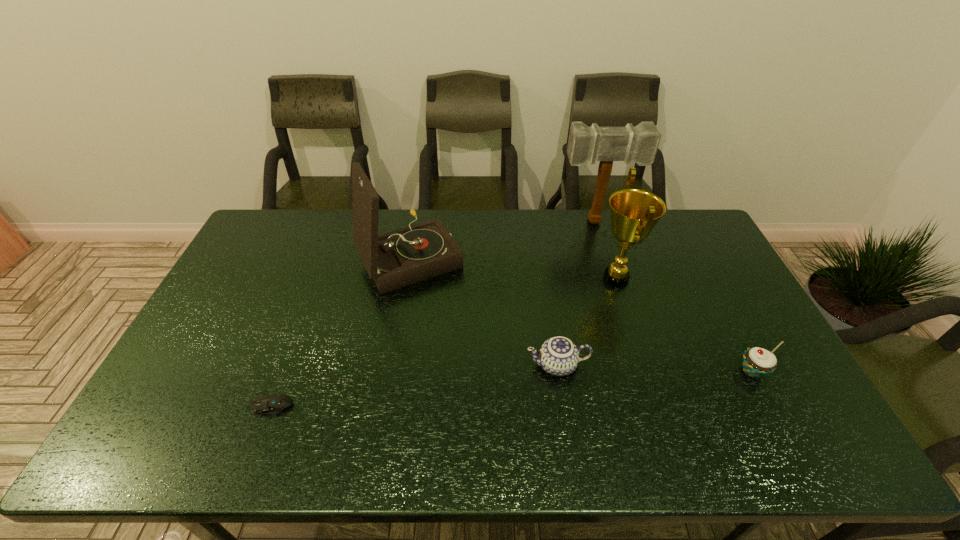
Locate an element on the screen. empty space between the fifth object from right to left and the rightmost object is located at coordinates (581, 314).

The height and width of the screenshot is (540, 960). I want to click on vacant region between the second object from left to right and the nearest object, so click(x=340, y=332).

Where is `vacant space that is in between the cupcake and the mallet`? vacant space that is in between the cupcake and the mallet is located at coordinates (674, 296).

Locate an element on the screen. The image size is (960, 540). object that is the fourth closest to the mallet is located at coordinates (757, 362).

Find the location of a particular element. The width and height of the screenshot is (960, 540). object that is the third closest to the chinaware is located at coordinates (757, 362).

This screenshot has width=960, height=540. What are the coordinates of `free space that satisfies the following two spatial constraints: 1. from the spout of the chinaware; 2. on the right side of the cupcake` in the screenshot? It's located at (558, 371).

Locate an element on the screen. The height and width of the screenshot is (540, 960). blank area in the image that satisfies the following two spatial constraints: 1. on the front view with handles of the award; 2. on the right side of the rightmost object is located at coordinates (645, 371).

You are a GUI agent. You are given a task and a screenshot of the screen. Output one action in this format:
    pyautogui.click(x=<x>, y=<y>)
    Task: Click on the free space that satisfies the following two spatial constraints: 1. on the back side of the cupcake; 2. on the front view with handles of the award
    
    Given the screenshot: What is the action you would take?
    pyautogui.click(x=704, y=279)

Find the location of a particular element. Image resolution: width=960 pixels, height=540 pixels. vacant area that satisfies the following two spatial constraints: 1. on the front view with handles of the cupcake; 2. on the left side of the award is located at coordinates (645, 371).

Where is `vacant area that satisfies the following two spatial constraints: 1. on the front side of the cupcake; 2. on the left side of the mallet`? vacant area that satisfies the following two spatial constraints: 1. on the front side of the cupcake; 2. on the left side of the mallet is located at coordinates (642, 371).